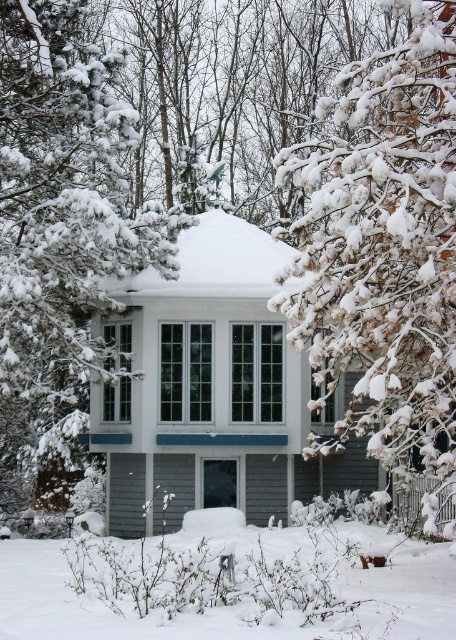
You are a delivery person trying to reach the front door of the house. The white matte gazebo at center and the white fluffy snow at lower center are in your path. Which object is closer to the ground and might block your path?

The white fluffy snow at lower center is taller than the white matte gazebo at center, so the gazebo is closer to the ground and might block your path.